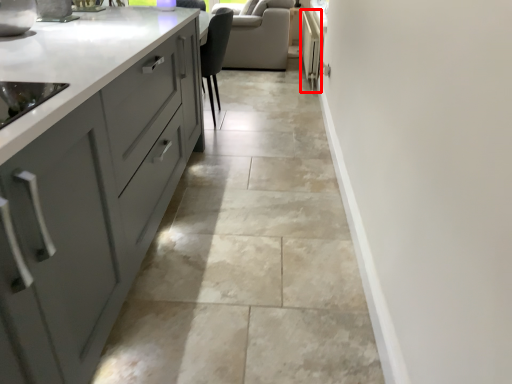
Question: From the image's perspective, considering the relative positions of appliance (annotated by the red box) and granite in the image provided, where is appliance (annotated by the red box) located with respect to the staircase?

Choices:
 (A) below
 (B) above

Answer: (B)